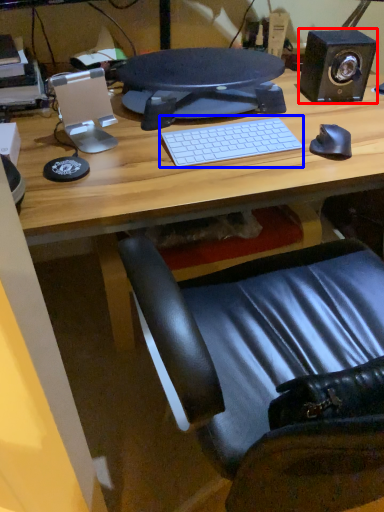
Question: Which point is further to the camera, speaker (highlighted by a red box) or computer keyboard (highlighted by a blue box)?

Choices:
 (A) speaker
 (B) computer keyboard

Answer: (A)